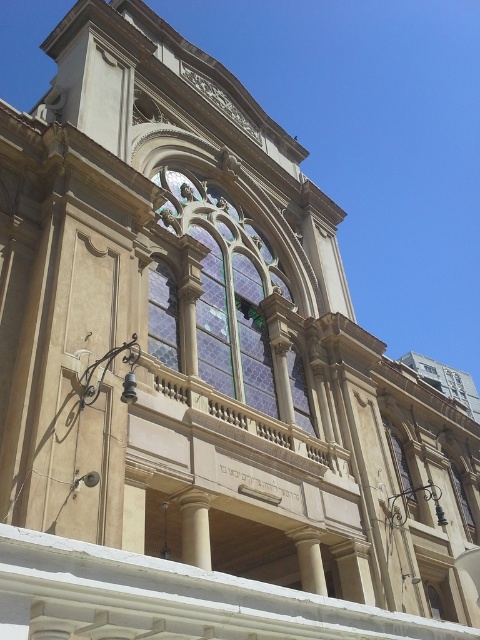
Question: Is stained glass window at center below stained glass window at upper center?

Choices:
 (A) yes
 (B) no

Answer: (B)

Question: Can you confirm if stained glass window at center is positioned to the right of stained glass window at upper center?

Choices:
 (A) no
 (B) yes

Answer: (B)

Question: Which object appears closest to the camera in this image?

Choices:
 (A) stained glass window at center
 (B) stained glass window at upper center

Answer: (A)

Question: Which point is closer to the camera?

Choices:
 (A) stained glass window at center
 (B) stained glass window at upper center

Answer: (A)

Question: Does stained glass window at center appear under stained glass window at upper center?

Choices:
 (A) yes
 (B) no

Answer: (B)

Question: Which point appears farthest from the camera in this image?

Choices:
 (A) (175, 333)
 (B) (260, 326)

Answer: (B)